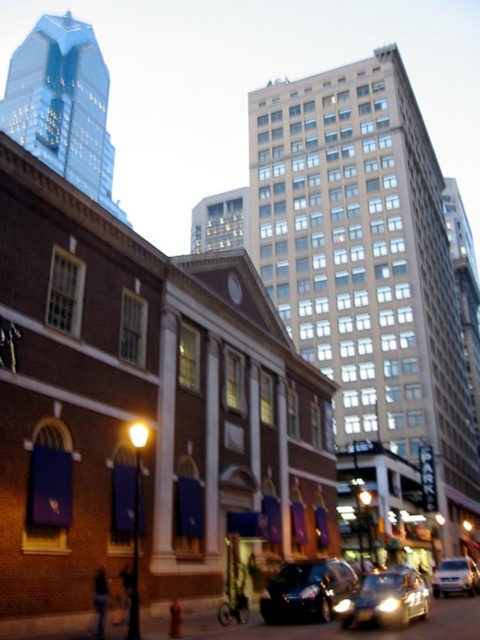
You are a delivery driver who needs to park your vehicle in a parking spot that is only 1.5 meters tall. You have two options in the image, the shiny black sedan at center and the silver metallic van at lower right. Which vehicle can fit into the parking spot?

The shiny black sedan at center has a lesser height compared to the silver metallic van at lower right, so the shiny black sedan at center can fit into the parking spot since its height is under 1.5 meters.